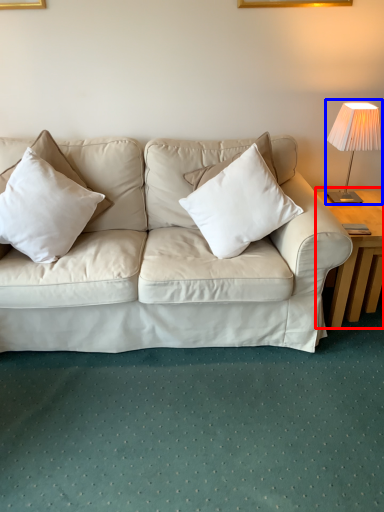
Question: Which object appears farthest to the camera in this image, table (highlighted by a red box) or table lamp (highlighted by a blue box)?

Choices:
 (A) table
 (B) table lamp

Answer: (B)